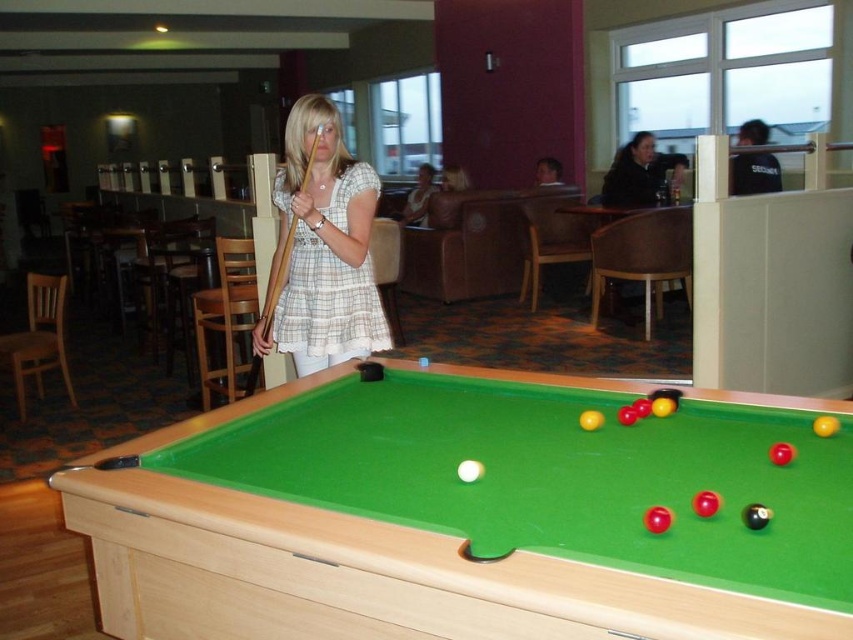
Between point (756, 490) and point (339, 304), which one is positioned behind?

The point (339, 304) is behind.

Does point (212, 490) come in front of point (331, 144)?

That is True.

Does point (201, 420) come in front of point (271, 323)?

Yes, it is in front of point (271, 323).

At what (x,y) coordinates should I click in order to perform the action: click on green felt billiard table at center. Please return your answer as a coordinate pair (x, y). The image size is (853, 640). Looking at the image, I should click on (468, 515).

Identify the location of plaid fabric shirt at center. (321, 248).

The image size is (853, 640). Find the location of `plaid fabric shirt at center`. plaid fabric shirt at center is located at coordinates (321, 248).

Is green felt billiard table at center behind wooden at left?

No, green felt billiard table at center is in front of wooden at left.

Where is `green felt billiard table at center`? The width and height of the screenshot is (853, 640). green felt billiard table at center is located at coordinates (468, 515).